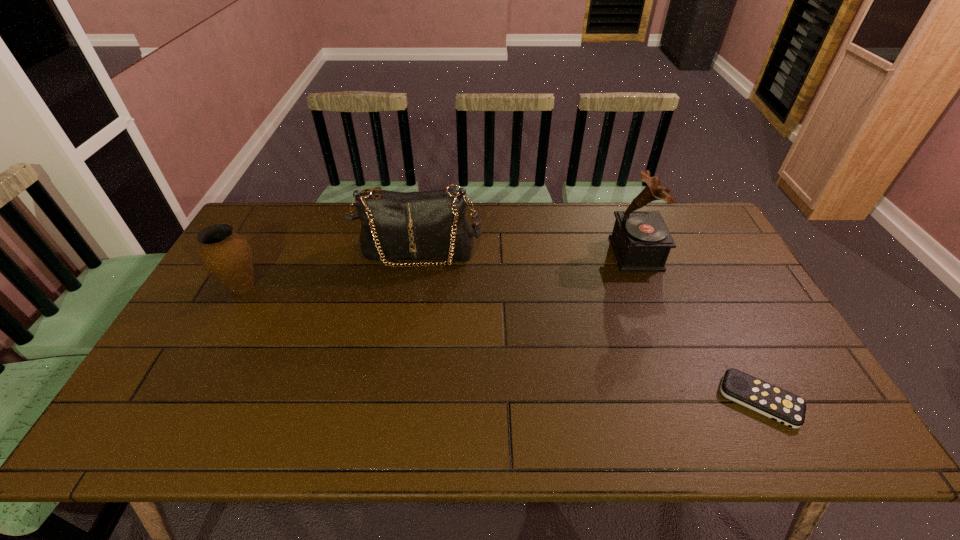
I want to click on free space located on the back of the third farthest object, so click(282, 215).

This screenshot has width=960, height=540. I want to click on vacant space located 0.160m on the left of the remote control, so click(655, 400).

Locate an element on the screen. The height and width of the screenshot is (540, 960). phonograph_record located in the far edge section of the desktop is located at coordinates (641, 241).

The image size is (960, 540). I want to click on handbag that is positioned at the far edge, so click(430, 225).

Identify the location of object that is at the near edge. (778, 404).

Where is `object that is positioned at the left edge`? The image size is (960, 540). object that is positioned at the left edge is located at coordinates (227, 256).

This screenshot has height=540, width=960. What are the coordinates of `object that is at the right edge` in the screenshot? It's located at (778, 404).

You are a GUI agent. You are given a task and a screenshot of the screen. Output one action in this format:
    pyautogui.click(x=<x>, y=<y>)
    Task: Click on the object that is at the near right corner
    
    Given the screenshot: What is the action you would take?
    pyautogui.click(x=778, y=404)

The width and height of the screenshot is (960, 540). In the image, there is a desktop. Identify the location of free space at the far edge. (524, 231).

Identify the location of vacant space at the left edge of the desktop. (197, 386).